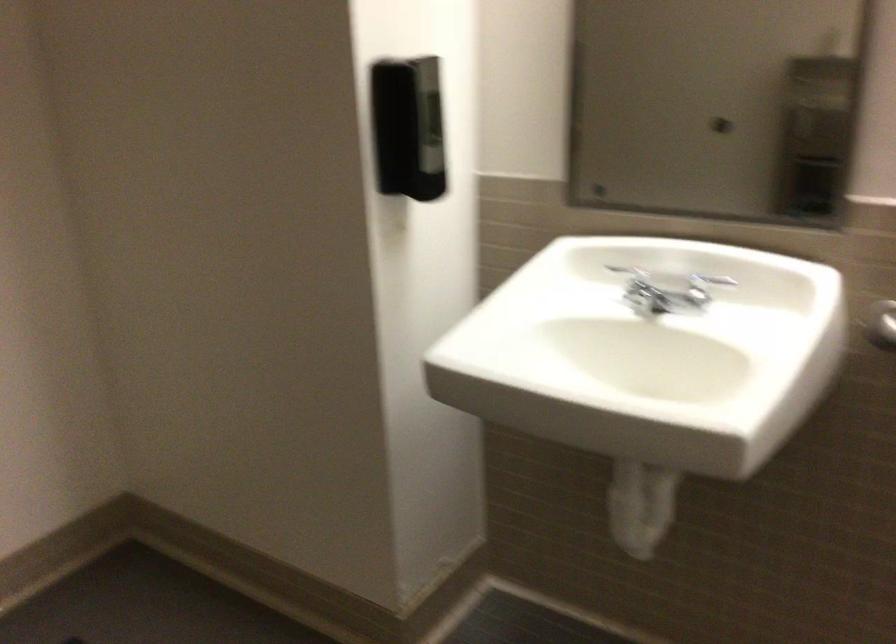
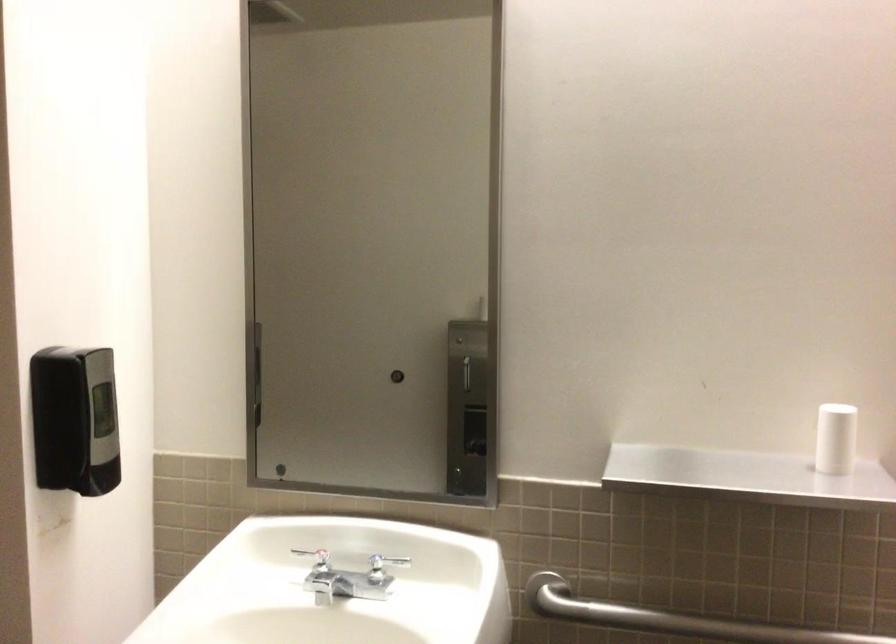
Question: Based on the continuous images, in which direction is the camera rotating? Reply with the corresponding letter.

Choices:
 (A) Left
 (B) Right
 (C) Up
 (D) Down

Answer: (B)